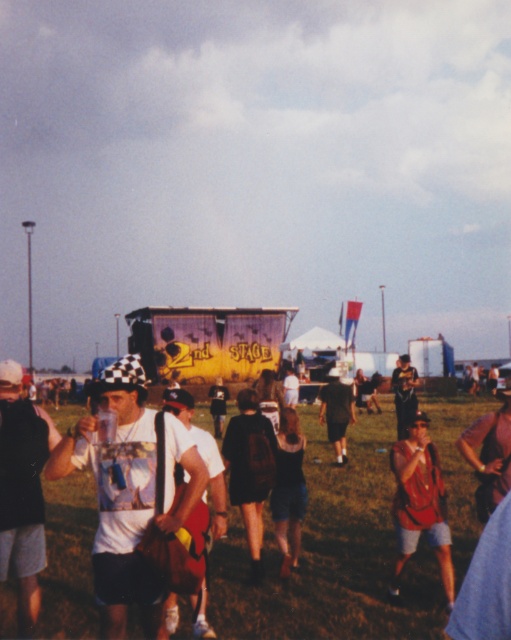
You are at the music festival and need to find someone wearing a black matte shirt at left. According to the coordinates provided, where should you look to find this person?

The black matte shirt at left is located at point (21, 492), so you should look towards the lower left area of the image based on the coordinate system provided.

You are an event organizer at the music festival. You need to place a 1.2 meter tall banner between the black matte shirt at left and the dark brown backpack at center. Will the banner fit vertically between them?

The black matte shirt at left is taller than the dark brown backpack at center, so the 1.2 meter tall banner can be placed between them vertically as the height difference allows sufficient space.